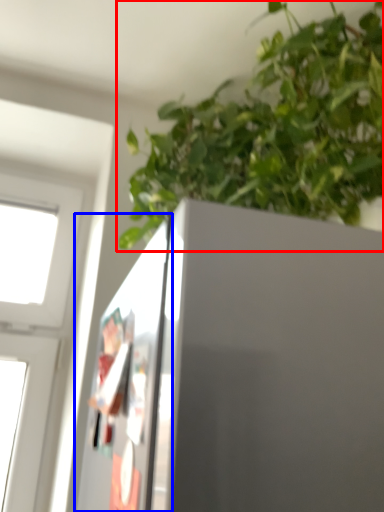
Question: Which object is further to the camera taking this photo, houseplant (highlighted by a red box) or screen door (highlighted by a blue box)?

Choices:
 (A) houseplant
 (B) screen door

Answer: (A)